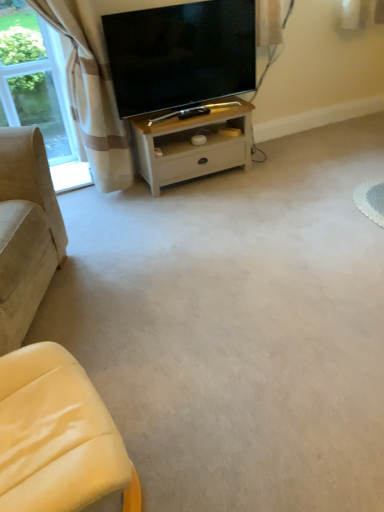
Locate an element on the screen. The width and height of the screenshot is (384, 512). vacant space to the right of white wood table at center is located at coordinates (274, 175).